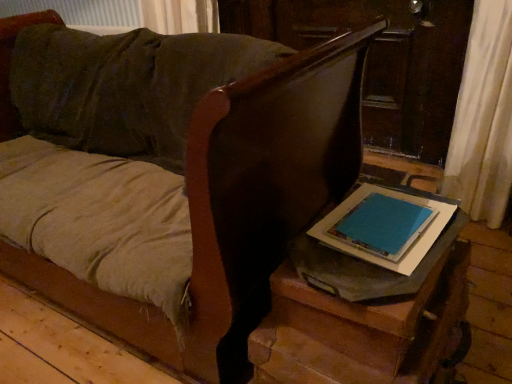
In order to click on free space above matte gray table at lower right (from a real-world perspective) in this screenshot , I will do `click(381, 228)`.